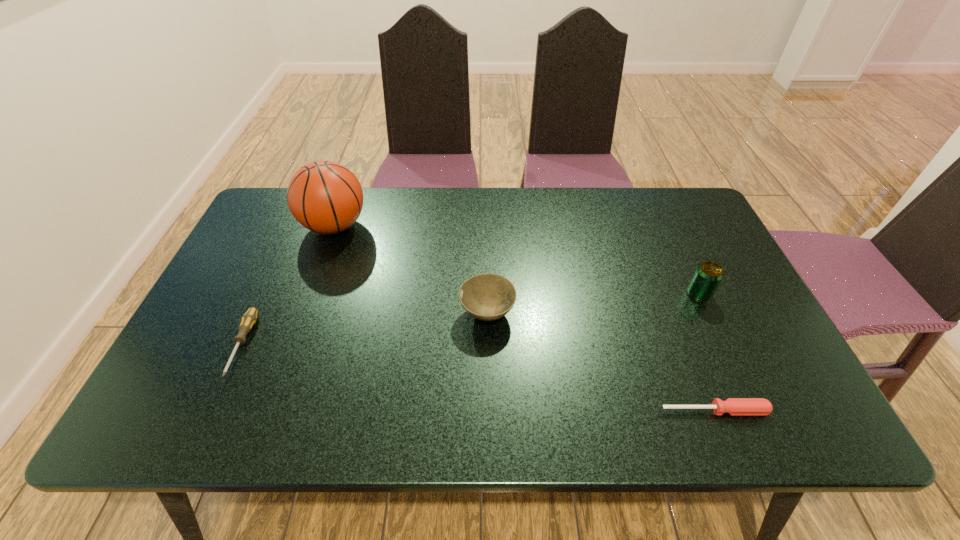
Identify the location of basketball. This screenshot has height=540, width=960. (325, 197).

The image size is (960, 540). I want to click on the tallest object, so click(x=325, y=197).

At what (x,y) coordinates should I click in order to perform the action: click on beer can. Please return your answer as a coordinate pair (x, y). This screenshot has width=960, height=540. Looking at the image, I should click on (708, 275).

Locate an element on the screen. bowl is located at coordinates (488, 297).

Where is `the third shortest object`? the third shortest object is located at coordinates [488, 297].

You are a GUI agent. You are given a task and a screenshot of the screen. Output one action in this format:
    pyautogui.click(x=<x>, y=<y>)
    Task: Click on the left screwdriver
    Image resolution: width=960 pixels, height=540 pixels.
    Given the screenshot: What is the action you would take?
    (249, 318)

At what (x,y) coordinates should I click in order to perform the action: click on the nearest object. Please return your answer as a coordinate pair (x, y). This screenshot has height=540, width=960. Looking at the image, I should click on (733, 406).

Where is `the nearer screwdriver`? The image size is (960, 540). the nearer screwdriver is located at coordinates (733, 406).

Where is `free region located on the front of the tallest object`? The height and width of the screenshot is (540, 960). free region located on the front of the tallest object is located at coordinates (305, 308).

This screenshot has height=540, width=960. Identify the location of vacant space situated 0.340m on the front of the fourth shortest object. (762, 431).